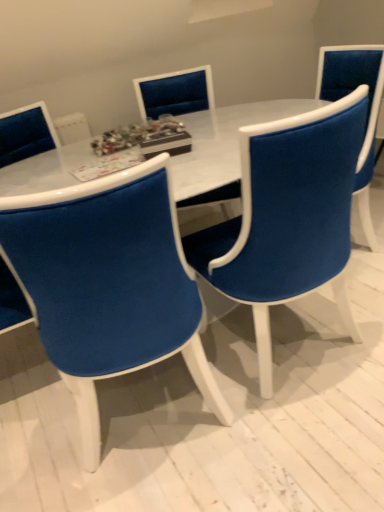
Question: Is white marble table at center outside of velvet blue chair at center, the third chair positioned from the back?

Choices:
 (A) no
 (B) yes

Answer: (B)

Question: From the image's perspective, would you say white marble table at center is shown under velvet blue chair at center, arranged as the first chair when viewed from the front?

Choices:
 (A) yes
 (B) no

Answer: (B)

Question: From a real-world perspective, does white marble table at center stand above velvet blue chair at center, arranged as the first chair when viewed from the front?

Choices:
 (A) no
 (B) yes

Answer: (A)

Question: Does white marble table at center have a greater width compared to velvet blue chair at center, arranged as the first chair when viewed from the front?

Choices:
 (A) no
 (B) yes

Answer: (B)

Question: Can you confirm if white marble table at center is bigger than velvet blue chair at center, the third chair positioned from the back?

Choices:
 (A) yes
 (B) no

Answer: (A)

Question: Considering the positions of velvet blue chair at center, the 1th chair in the back-to-front sequence, and white marble table at center in the image, is velvet blue chair at center, the 1th chair in the back-to-front sequence, taller or shorter than white marble table at center?

Choices:
 (A) tall
 (B) short

Answer: (A)

Question: Do you think velvet blue chair at center, the 1th chair in the back-to-front sequence, is within white marble table at center, or outside of it?

Choices:
 (A) outside
 (B) inside

Answer: (B)

Question: From a real-world perspective, is velvet blue chair at center, the 1th chair in the back-to-front sequence, positioned above or below white marble table at center?

Choices:
 (A) above
 (B) below

Answer: (A)

Question: From the image's perspective, is velvet blue chair at center, the 1th chair in the back-to-front sequence, located above or below white marble table at center?

Choices:
 (A) below
 (B) above

Answer: (B)

Question: Choose the correct answer: Is velvet blue chair at center, placed as the 2th chair when sorted from back to front, inside velvet blue chair at center, arranged as the first chair when viewed from the front, or outside it?

Choices:
 (A) inside
 (B) outside

Answer: (B)

Question: In the image, is velvet blue chair at center, placed as the 2th chair when sorted from back to front, positioned in front of or behind velvet blue chair at center, the third chair positioned from the back?

Choices:
 (A) behind
 (B) front

Answer: (A)

Question: Is point (253, 158) closer or farther from the camera than point (96, 397)?

Choices:
 (A) closer
 (B) farther

Answer: (A)

Question: From the image's perspective, is velvet blue chair at center, the 2th chair positioned from the front, positioned above or below velvet blue chair at center, arranged as the first chair when viewed from the front?

Choices:
 (A) above
 (B) below

Answer: (A)

Question: Choose the correct answer: Is velvet blue chair at center, the third chair positioned from the back, inside velvet blue chair at center, placed as the 2th chair when sorted from back to front, or outside it?

Choices:
 (A) inside
 (B) outside

Answer: (B)

Question: Considering the positions of velvet blue chair at center, arranged as the first chair when viewed from the front, and velvet blue chair at center, placed as the 2th chair when sorted from back to front, in the image, is velvet blue chair at center, arranged as the first chair when viewed from the front, wider or thinner than velvet blue chair at center, placed as the 2th chair when sorted from back to front,?

Choices:
 (A) thin
 (B) wide

Answer: (A)